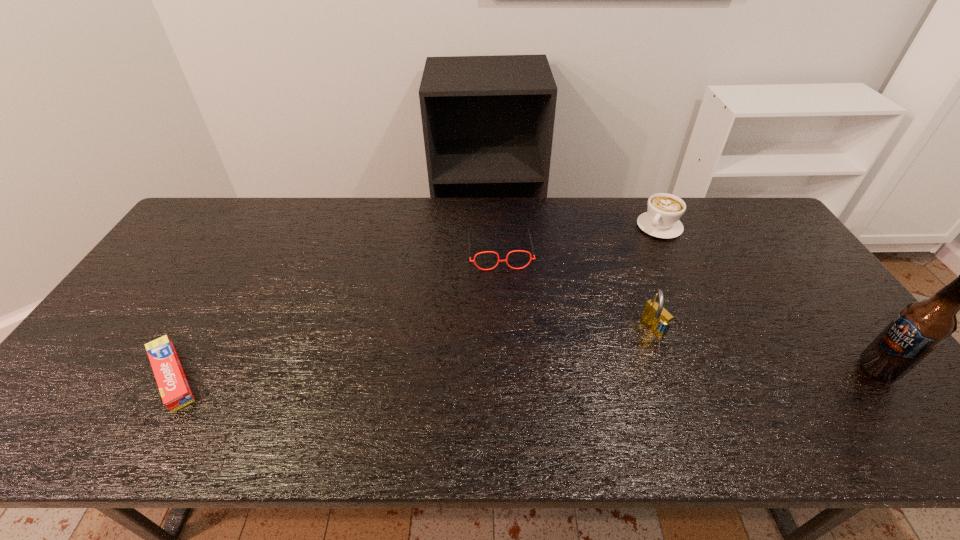
Where is `free spot on the desktop that is between the shortest object and the beer bottle and is positioned on the side with the combination dials of the padlock`? The height and width of the screenshot is (540, 960). free spot on the desktop that is between the shortest object and the beer bottle and is positioned on the side with the combination dials of the padlock is located at coordinates (572, 372).

Where is `vacant space on the desktop that is between the shortest object and the rightmost object and is positioned on the front-facing side of the fourth object from right to left`? The height and width of the screenshot is (540, 960). vacant space on the desktop that is between the shortest object and the rightmost object and is positioned on the front-facing side of the fourth object from right to left is located at coordinates (516, 373).

Where is `vacant space on the desktop that is between the toothpaste and the rightmost object and is positioned to the right of the third shortest object's handle`? vacant space on the desktop that is between the toothpaste and the rightmost object and is positioned to the right of the third shortest object's handle is located at coordinates (553, 372).